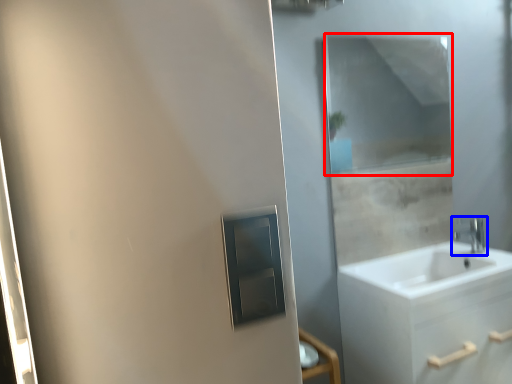
Question: Among these objects, which one is farthest to the camera, mirror (highlighted by a red box) or tap (highlighted by a blue box)?

Choices:
 (A) mirror
 (B) tap

Answer: (B)